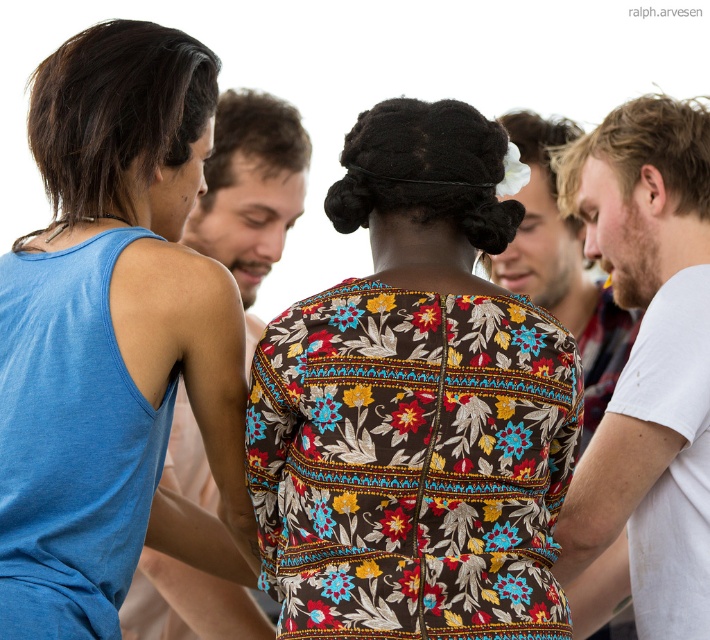
You are a photographer standing in front of the group. You want to capture a closeup shot of the floral fabric dress at center. Given that your camera has a minimum focusing distance of 2 meters, will you be able to take the photo without moving closer?

The distance between the floral fabric dress at center and the viewer is 2.36 meters, which is greater than the camera minimum focusing distance of 2 meters. Therefore, you can take the closeup shot without moving closer.